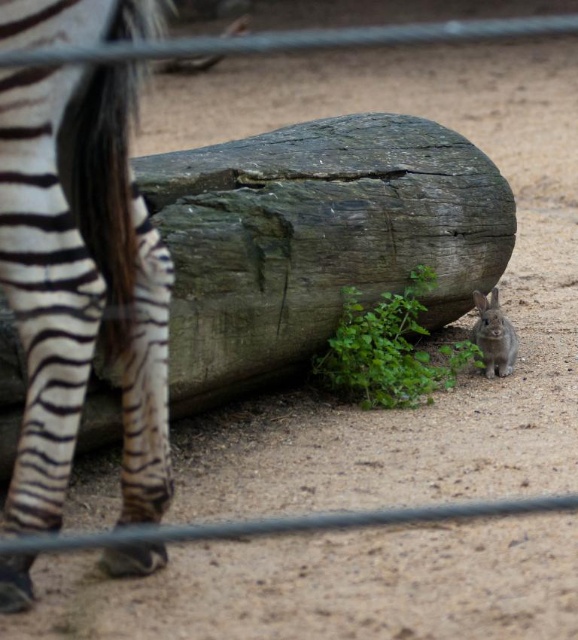
You are a zookeeper observing the enclosure. You need to place a new feeding tray between the black and white striped zebra at left and the green leafy plant at lower right. Based on their positions, where should you place the feeding tray so it is equidistant from both?

The feeding tray should be placed between the black and white striped zebra at left and the green leafy plant at lower right, positioned so it is equidistant from both since the zebra is in front of the plant, creating a straight line path between them.

You are a zookeeper observing the enclosure. You notice the green leafy plant at lower right and the gray furry rabbit at lower right. Which object is positioned more to the right side of the image?

The gray furry rabbit at lower right is positioned more to the right side of the image because the green leafy plant at lower right is to the left of it.

You are a zookeeper observing the enclosure. You notice the black and white striped zebra at left and the gray furry rabbit at lower right. Which animal is positioned higher in the image?

The black and white striped zebra at left is positioned higher than the gray furry rabbit at lower right.